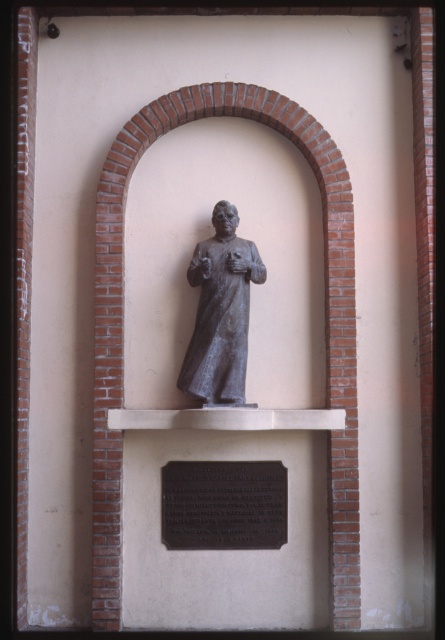
Who is higher up, bronze plaque at center or bronze statue at center?

bronze statue at center

Which is more to the right, bronze plaque at center or bronze statue at center?

bronze statue at center

Is point (169, 497) closer to viewer compared to point (237, 385)?

No, it is behind (237, 385).

Image resolution: width=445 pixels, height=640 pixels. Identify the location of bronze plaque at center. (223, 504).